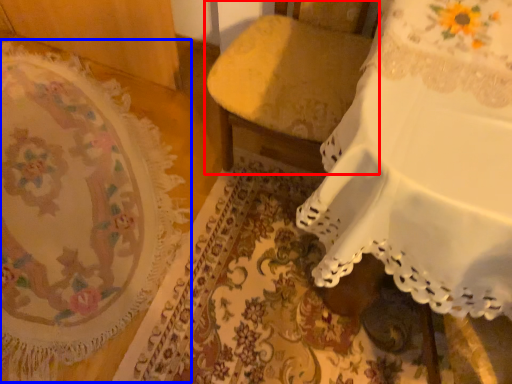
Question: Which object is closer to the camera taking this photo, furniture (highlighted by a red box) or mat (highlighted by a blue box)?

Choices:
 (A) furniture
 (B) mat

Answer: (A)